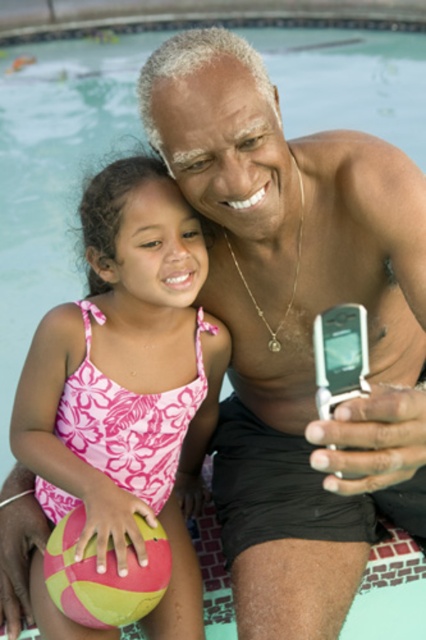
Consider the image. You are a photographer at the swimming pool. You need to capture a photo of the pink floral swimsuit at center and the multicolored rubber ball at lower left. Which object should you focus on first if you want to include both in the frame without moving the camera?

The pink floral swimsuit at center is located above the multicolored rubber ball at lower left, so you should focus on the pink floral swimsuit at center first to ensure both are in the frame.

You are a photographer trying to capture a clear photo of the multicolored rubber ball at lower left without the pink floral swimsuit at center blocking it. Based on the scene, where should you position yourself to achieve this?

The multicolored rubber ball at lower left is behind the pink floral swimsuit at center, so you should move to a position where you can see around or behind the pink floral swimsuit at center to get an unobstructed view of the multicolored rubber ball at lower left.

You are designing a storage box for the pink floral swimsuit at center and the multicolored rubber ball at lower left. The box must accommodate both items without overlapping. Which item requires a wider compartment?

The pink floral swimsuit at center requires a wider compartment because its width is larger than the multicolored rubber ball at lower left.